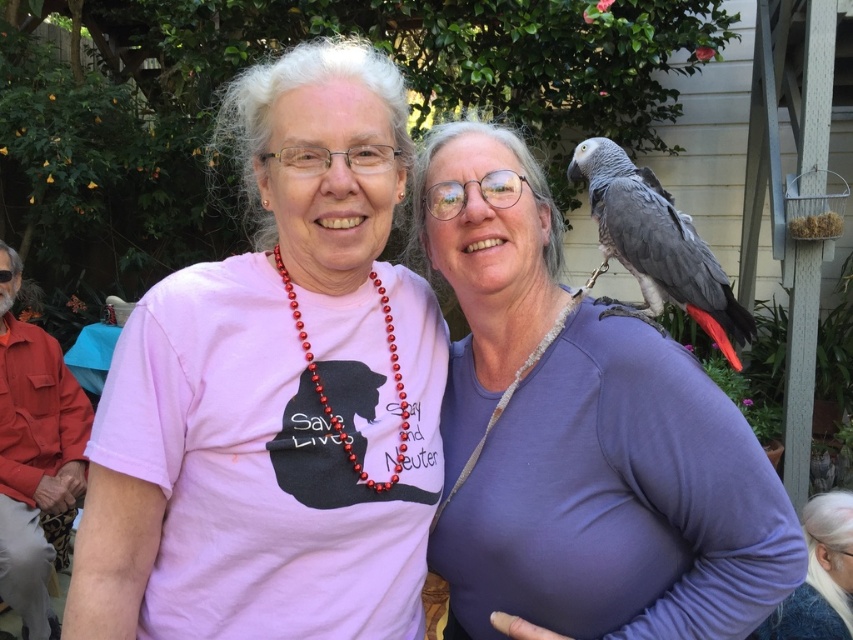
You are trying to decide which parrot to adopt between the matte gray parrot at upper right and the gray matte parrot at upper right. Which one is wider?

The matte gray parrot at upper right might be wider than gray matte parrot at upper right.